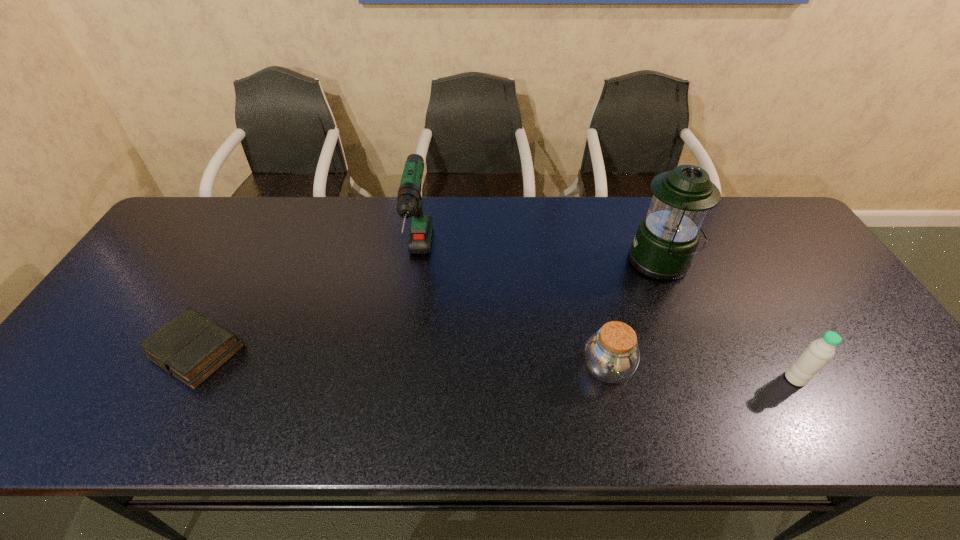
I want to click on unoccupied position between the book and the lantern, so click(429, 306).

Identify the location of free area in between the leftmost object and the drill. (307, 305).

Identify the location of free space between the drill and the third object from right to left. (513, 314).

At what (x,y) coordinates should I click in order to perform the action: click on free space between the leftmost object and the lantern. Please return your answer as a coordinate pair (x, y). The height and width of the screenshot is (540, 960). Looking at the image, I should click on (429, 306).

This screenshot has width=960, height=540. I want to click on free spot between the lantern and the second shortest object, so click(x=634, y=315).

The width and height of the screenshot is (960, 540). Identify the location of free space that is in between the second object from left to right and the third object from right to left. (513, 314).

What are the coordinates of `vacant space in between the shortest object and the fourth object from left to right` in the screenshot? It's located at (429, 306).

Image resolution: width=960 pixels, height=540 pixels. I want to click on free space that is in between the book and the jar, so click(x=401, y=360).

The image size is (960, 540). In order to click on empty space between the fourth object from right to left and the water bottle in this screenshot , I will do `click(607, 319)`.

Where is `vacant space in between the shortest object and the second shortest object`? vacant space in between the shortest object and the second shortest object is located at coordinates (401, 360).